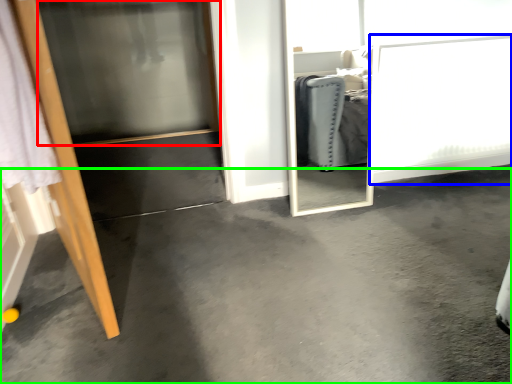
Question: Based on their relative distances, which object is nearer to screen door (highlighted by a red box)? Choose from screen door (highlighted by a blue box) and concrete (highlighted by a green box).

Choices:
 (A) screen door
 (B) concrete

Answer: (A)